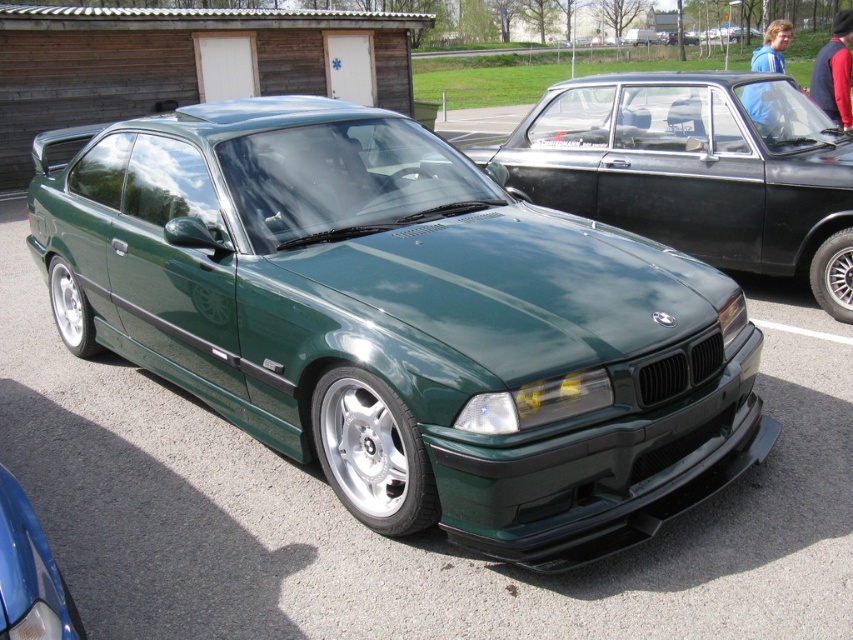
You are standing in front of a dark green BMW sports car at a car exhibition. You notice a point marked at coordinates [403,321]. What does this point represent?

The point at coordinates [403,321] indicates the green metallic car at center.

You are a photographer setting up a shoot for a car magazine. You have a green matte car at center and a metallic blue car at lower left in your frame. The magazine requires that the two cars must be at least 15 feet apart to avoid overlapping in the photo. Based on the scene description, can you confirm if the current positioning meets this requirement?

The green matte car at center is 16.77 feet from the metallic blue car at lower left. Since 16.77 feet is greater than the required 15 feet, the current positioning meets the magazine requirement.